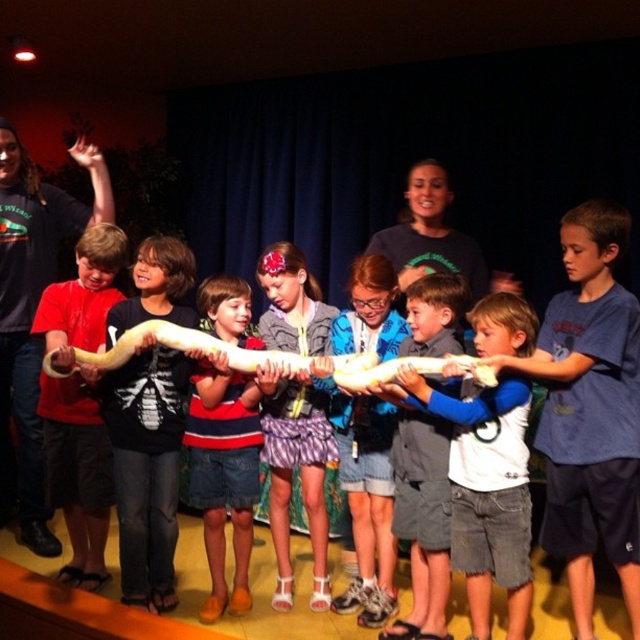
Question: Which of the following is the farthest from the observer?

Choices:
 (A) white matte vest at center
 (B) striped cotton shirt at center

Answer: (B)

Question: Can you confirm if matte red shirt at left is positioned to the right of striped cotton shirt at center?

Choices:
 (A) no
 (B) yes

Answer: (A)

Question: Which of the following is the closest to the observer?

Choices:
 (A) white matte vest at center
 (B) plaid skirt at center

Answer: (A)

Question: Does white matte vest at center appear under striped cotton shirt at center?

Choices:
 (A) no
 (B) yes

Answer: (B)

Question: Which object appears farthest from the camera in this image?

Choices:
 (A) white matte vest at center
 (B) striped cotton shirt at center

Answer: (B)

Question: Does matte red shirt at left appear on the left side of plaid skirt at center?

Choices:
 (A) yes
 (B) no

Answer: (A)